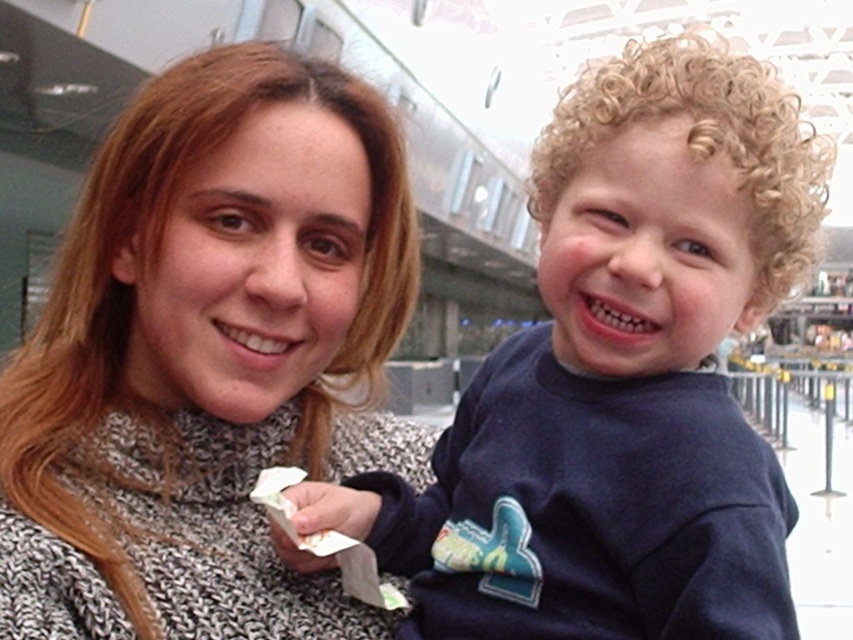
You are a photographer trying to capture a photo of both the knitted sweater at center and the dark blue sweatshirt at right. Since you can only focus on one subject at a time, which one should you focus on first to ensure both are in the frame?

You should focus on the knitted sweater at center first because it is positioned to the left of the dark blue sweatshirt at right, so starting with the left subject ensures both are included in the frame.

You are an AI analyzing the image. Please state the coordinates of the knitted sweater at center in the image. The coordinates should be in the format of a point with two decimal places separated by a comma, like this example format pointX, pointY. Please do not add any other information besides the coordinates.

The coordinates of the knitted sweater at center are at point (207, 356).